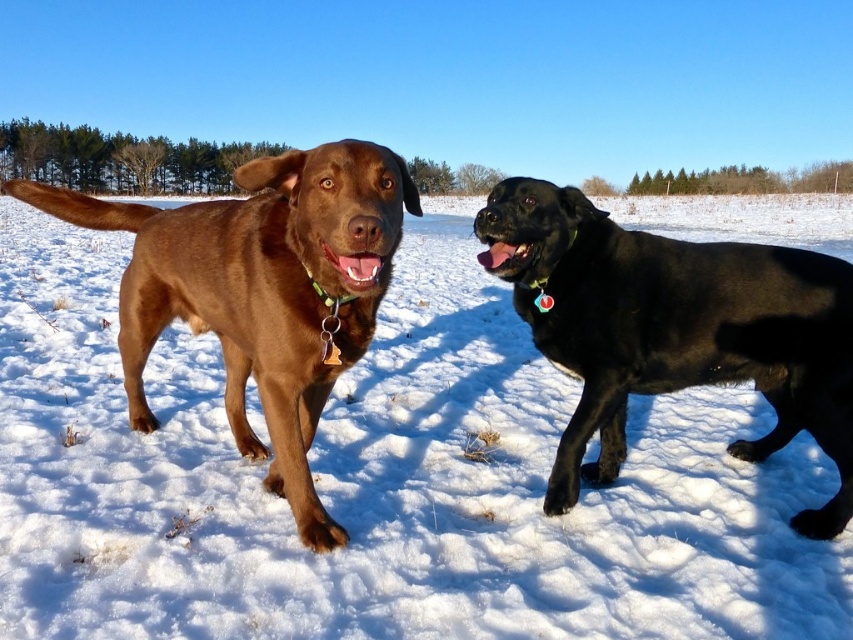
You are a photographer standing in the snowy landscape. You want to take a closeup photo of the white fluffy snow at center without getting your camera too dirty. The camera has a lens that can focus up to 2 meters. Can you take the photo without moving closer than 2 meters?

The white fluffy snow at center and camera are 2.05 meters apart from each other. Since the camera can focus up to 2 meters, you need to move slightly closer to ensure the lens can focus properly. Alternatively, adjust your position to be exactly 2 meters away for the best shot.

You are a photographer standing in the snowy landscape and want to take a photo of both the white fluffy snow at center and the black glossy dog at right. Based on their positions, which one will appear larger in the photo?

The white fluffy snow at center will appear larger in the photo because it is closer to the viewer than the black glossy dog at right.

You are a dog owner who wants to choose a taller dog between the black glossy dog at right and the matte brown dog at left. Which one should you choose?

The black glossy dog at right is taller than the matte brown dog at left, so you should choose the black glossy dog at right.